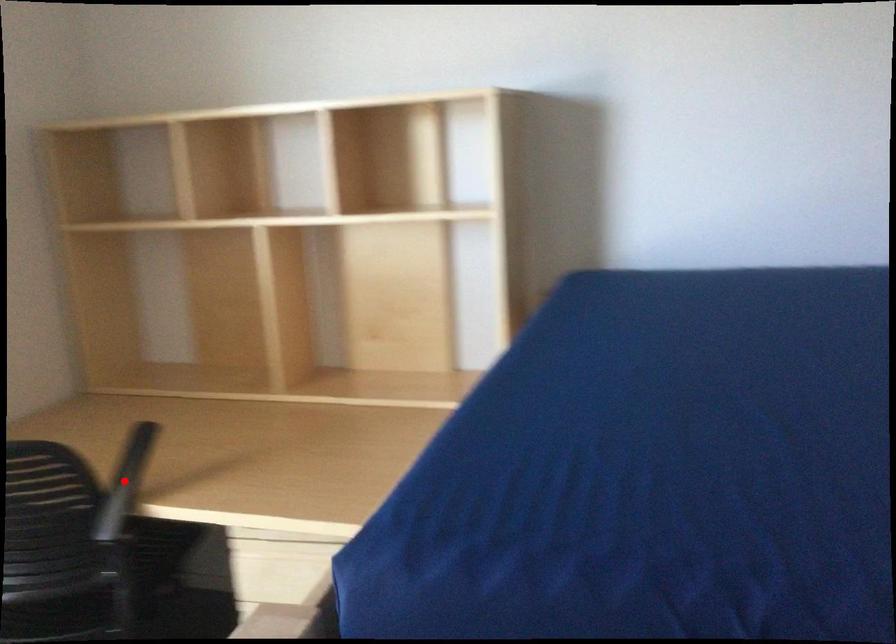
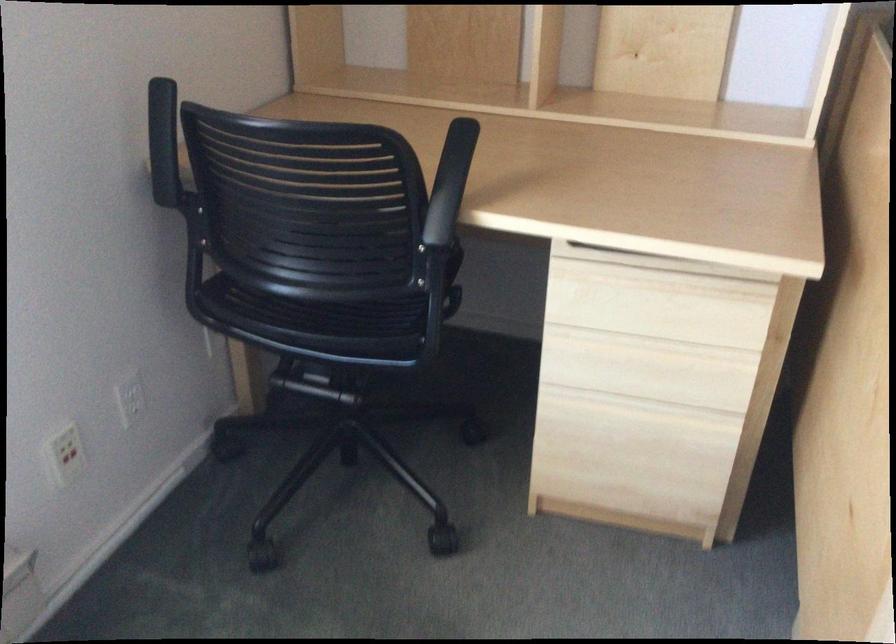
Question: I am providing you with two images of the same scene from different viewpoints. Image1 has a red point marked. In image2, the corresponding 3D location appears at what relative position? Reply with the corresponding letter.

Choices:
 (A) Closer
 (B) Farther

Answer: (A)